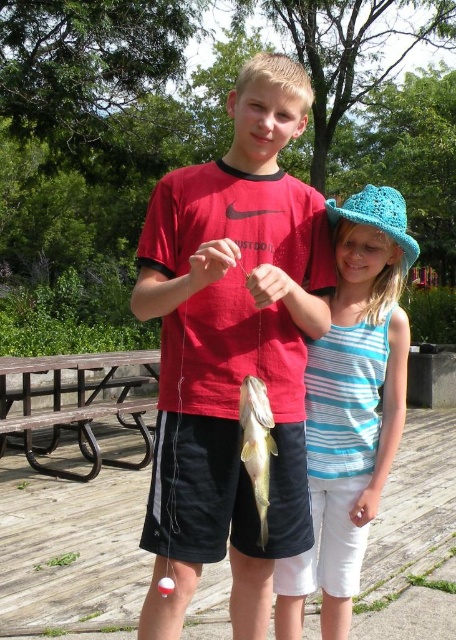
Who is taller, matte red shirt at center or brown wooden picnic table at lower left?

matte red shirt at center

Identify the location of matte red shirt at center. (232, 348).

You are a GUI agent. You are given a task and a screenshot of the screen. Output one action in this format:
    pyautogui.click(x=<x>, y=<y>)
    Task: Click on the matte red shirt at center
    This screenshot has width=456, height=640.
    Given the screenshot: What is the action you would take?
    pyautogui.click(x=232, y=348)

Is brown wooden picnic table at lower left smaller than yellowish-green shiny fish at center?

No.

Is brown wooden picnic table at lower left above yellowish-green shiny fish at center?

Incorrect, brown wooden picnic table at lower left is not positioned above yellowish-green shiny fish at center.

Which is in front, point (25, 406) or point (269, 420)?

Positioned in front is point (269, 420).

This screenshot has width=456, height=640. What are the coordinates of `brown wooden picnic table at lower left` in the screenshot? It's located at (76, 404).

What do you see at coordinates (355, 396) in the screenshot? I see `blue striped tank top at center` at bounding box center [355, 396].

Can you confirm if blue striped tank top at center is taller than yellowish-green shiny fish at center?

Yes, blue striped tank top at center is taller than yellowish-green shiny fish at center.

Locate an element on the screen. blue striped tank top at center is located at coordinates (355, 396).